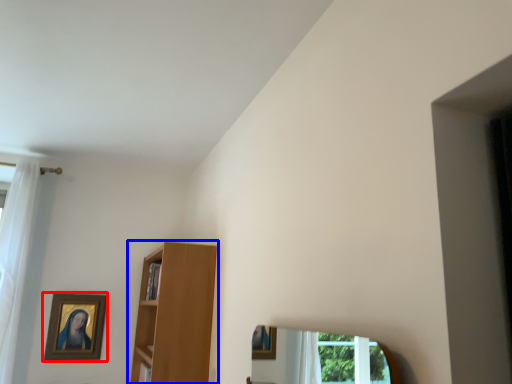
Question: Which point is closer to the camera, picture frame (highlighted by a red box) or shelf (highlighted by a blue box)?

Choices:
 (A) picture frame
 (B) shelf

Answer: (B)